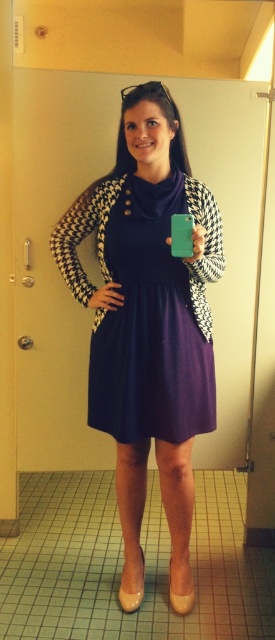
Question: Is matte black dress at center positioned at the back of purple matte dress at center?

Choices:
 (A) no
 (B) yes

Answer: (A)

Question: Can you confirm if matte black dress at center is smaller than purple matte dress at center?

Choices:
 (A) no
 (B) yes

Answer: (A)

Question: Can you confirm if matte black dress at center is thinner than purple matte dress at center?

Choices:
 (A) no
 (B) yes

Answer: (A)